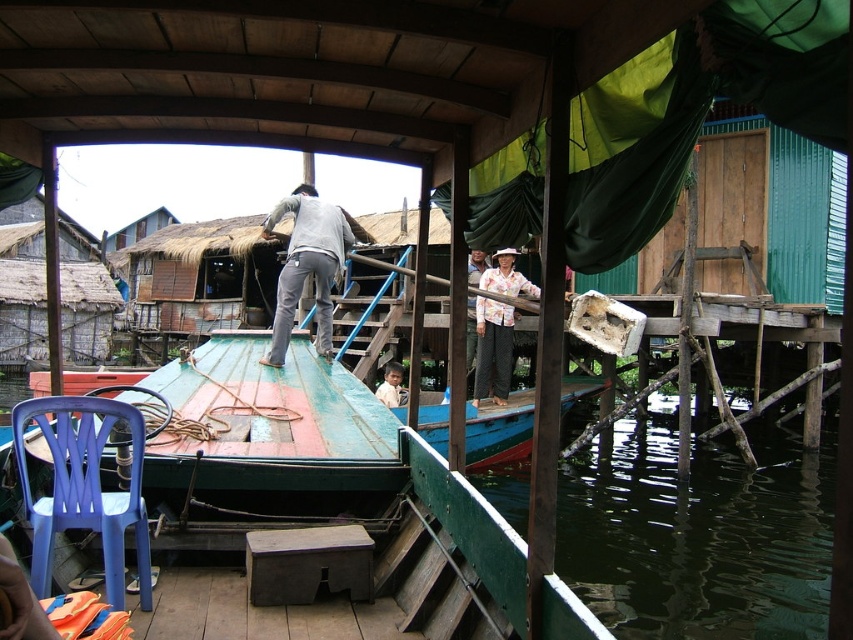
You are on the boat and want to avoid stepping into the dark green water at lower right. Which direction should you move relative to the white cotton shirt at center?

You should move away from the dark green water at lower right and towards the white cotton shirt at center since the water is in front of the shirt, meaning the shirt is between you and the water.

You are on a boat in a floating village and need to choose a shirt to wear for a photo. The floral fabric shirt at center and the white cotton shirt at center are both available. Which shirt would you pick if you want to look more prominent in the photo?

The floral fabric shirt at center is larger in size than the white cotton shirt at center, so choosing the floral fabric shirt at center would make you look more prominent in the photo.

You are a tailor observing two shirts on a boat deck in a floating village. The shirts are the floral fabric shirt at center and the white cotton shirt at center. Which shirt has a greater width?

The floral fabric shirt at center has a greater width than the white cotton shirt at center according to the description.